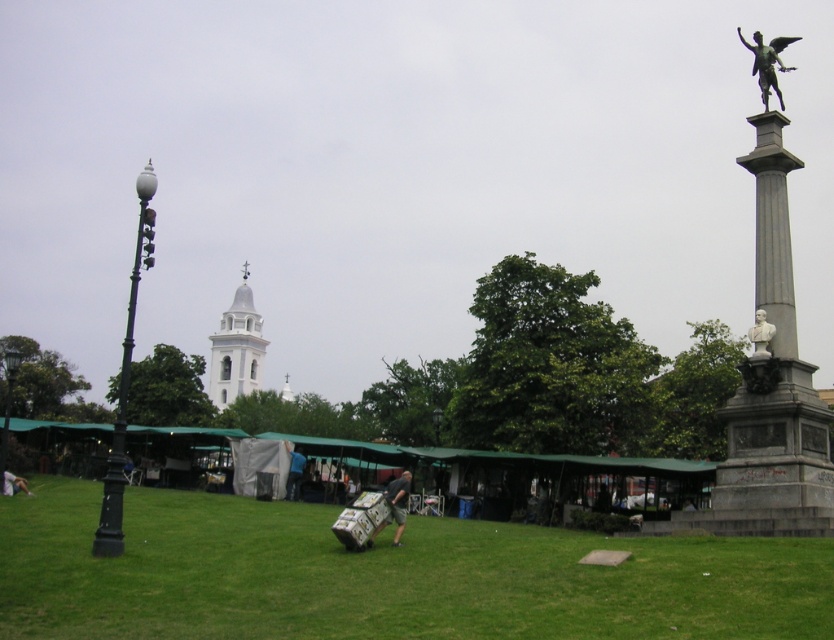
Question: Among these points, which one is nearest to the camera?

Choices:
 (A) (393, 506)
 (B) (761, 326)
 (C) (756, 65)

Answer: (A)

Question: Is gray stone statue at right wider than white stucco tower at center?

Choices:
 (A) no
 (B) yes

Answer: (B)

Question: Does bronze statue at upper right have a larger size compared to white marble bust at right?

Choices:
 (A) no
 (B) yes

Answer: (B)

Question: Estimate the real-world distances between objects in this image. Which object is closer to the gray stone statue at right?

Choices:
 (A) light brown leather jacket at lower left
 (B) blue fabric at center
 (C) white marble bust at right

Answer: (C)

Question: Can you confirm if green grass at center is positioned below gray stone statue at right?

Choices:
 (A) yes
 (B) no

Answer: (A)

Question: Which object is the closest to the blue fabric at center?

Choices:
 (A) gray stone statue at right
 (B) bronze statue at upper right
 (C) green grass at center
 (D) white marble bust at right

Answer: (C)